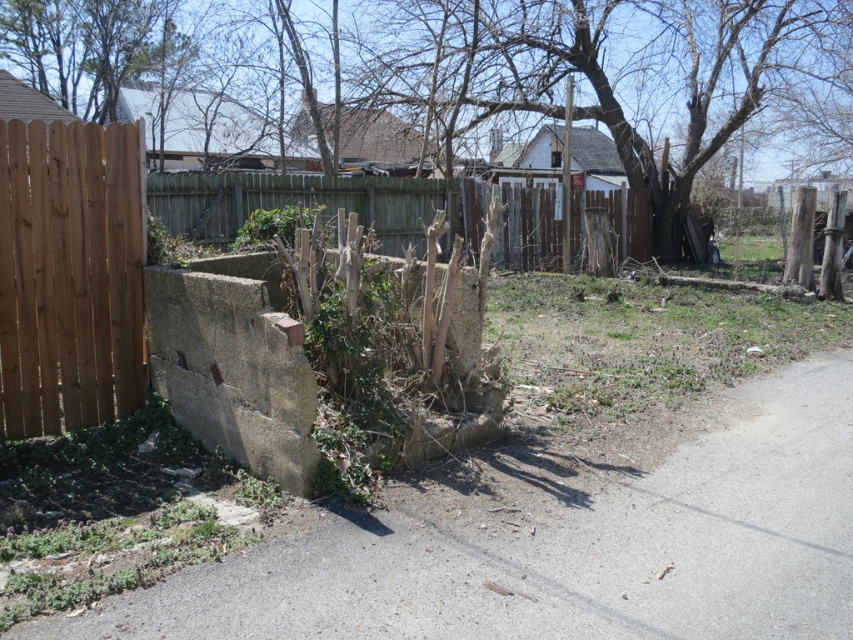
Question: Is the position of brown wood tree at center more distant than that of brown wooden fence at left?

Choices:
 (A) yes
 (B) no

Answer: (A)

Question: Which point is closer to the camera?

Choices:
 (A) brown wood tree at center
 (B) brown wooden fence at left

Answer: (B)

Question: Which object appears closest to the camera in this image?

Choices:
 (A) brown wood tree at center
 (B) brown wooden fence at left

Answer: (B)

Question: Observing the image, what is the correct spatial positioning of brown wood tree at center in reference to brown wooden fence at center?

Choices:
 (A) left
 (B) right

Answer: (A)

Question: Based on their relative distances, which object is farther from the brown wood tree at center?

Choices:
 (A) brown wooden fence at left
 (B) brown wooden fence at center

Answer: (A)

Question: Does brown wood tree at center have a lesser width compared to brown wooden fence at left?

Choices:
 (A) no
 (B) yes

Answer: (A)